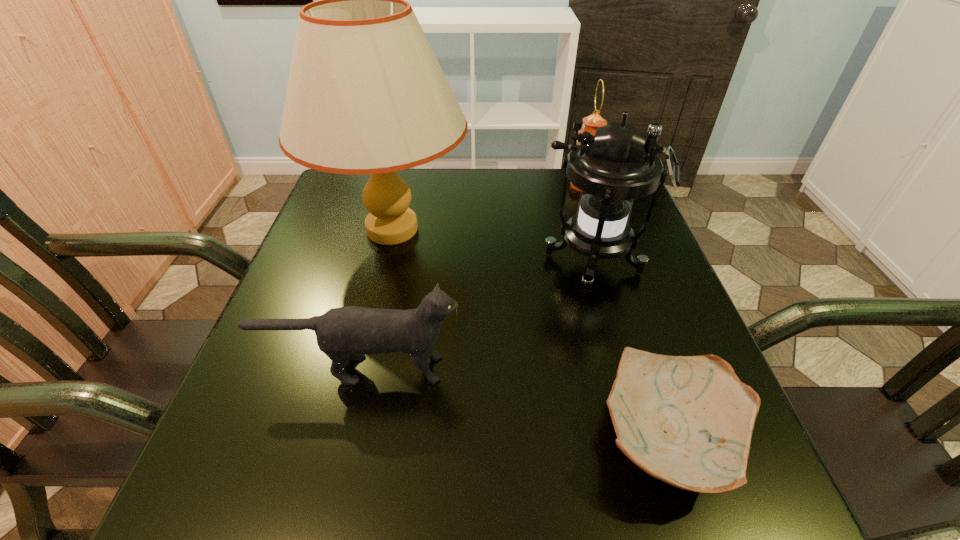
Find the location of `lampshade at the far edge`. lampshade at the far edge is located at coordinates (366, 95).

Locate an element on the screen. The height and width of the screenshot is (540, 960). oil lamp at the far edge is located at coordinates (591, 123).

The height and width of the screenshot is (540, 960). I want to click on object positioned at the near edge, so click(686, 420).

Locate an element on the screen. lampshade that is at the left edge is located at coordinates (366, 95).

Where is `cat located in the left edge section of the desktop`? Image resolution: width=960 pixels, height=540 pixels. cat located in the left edge section of the desktop is located at coordinates (348, 333).

At what (x,y) coordinates should I click in order to perform the action: click on lantern that is at the right edge. Please return your answer as a coordinate pair (x, y). The image size is (960, 540). Looking at the image, I should click on (613, 168).

The width and height of the screenshot is (960, 540). Find the location of `oil lamp that is positioned at the right edge`. oil lamp that is positioned at the right edge is located at coordinates (591, 123).

I want to click on pottery located in the right edge section of the desktop, so click(x=686, y=420).

Where is `object that is at the far left corner`? object that is at the far left corner is located at coordinates (366, 95).

This screenshot has width=960, height=540. I want to click on object situated at the far right corner, so click(591, 123).